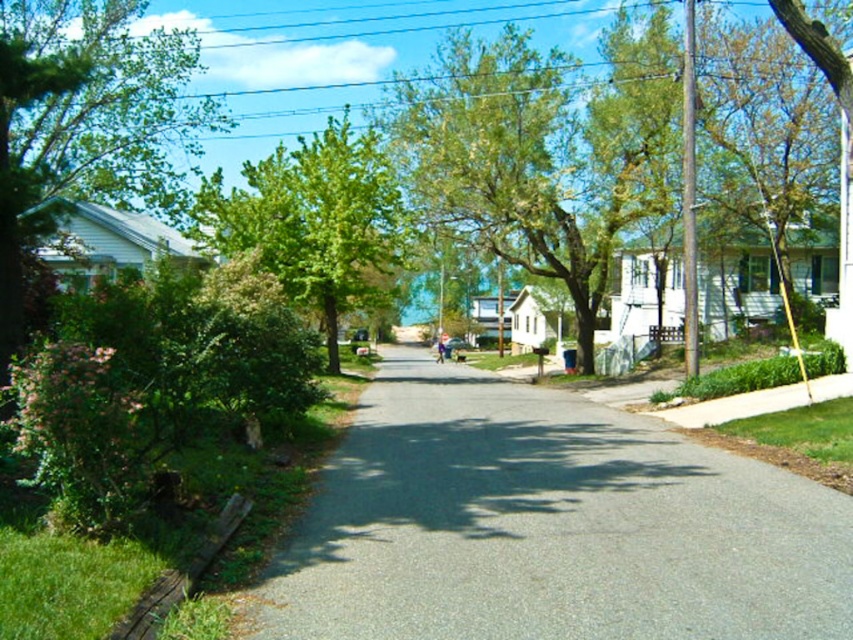
You are a pedestrian standing on the sidewalk and want to cross the gray asphalt road at center. To your left, you see the green leafy tree at center. Which direction should you walk to reach the road from the tree?

The gray asphalt road at center is positioned on the right side of the green leafy tree at center, so you should walk to the right to reach the road from the tree.

You are a pedestrian standing on the road between the green leafy tree at left and the green leafy tree at center. If you look forward, which tree appears closer to you?

The green leafy tree at left appears closer because it is in front of the green leafy tree at center, blocking part of the view to the one behind.

You are a pedestrian standing on the sidewalk and want to cross the gray asphalt road at center to reach the green leafy tree at left. Is the tree visible from your current position?

The gray asphalt road at center is in front of green leafy tree at left, so the tree is behind the road and not visible from your current position on the sidewalk.